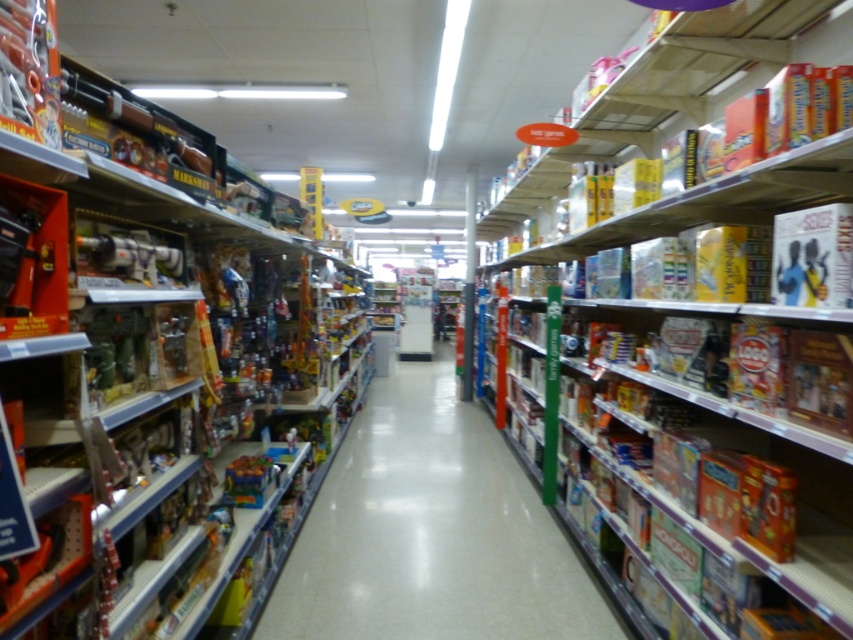
You are a store employee who needs to place a new shelf divider that is 18 inches tall between the cardboard game box at upper right and the matte plastic toys at center. Based on their heights, will the divider be visible above both items when placed between them?

The cardboard game box at upper right is taller than the matte plastic toys at center. Since the divider is 18 inches tall, if the cardboard game box is taller than 18 inches, the divider won t be visible above it. However, if the matte plastic toys are shorter than 18 inches, the divider will be visible above them. Without knowing the exact height of the cardboard game box, we can only confirm that the divider will be visible above the matte plastic toys at center but not necessarily the cardboard game box

You are a store employee who needs to place a new large item on the shelf. The cardboard game box at upper right and the matte plastic toys at center are already on the shelf. Which one can you replace to make space for the new item?

The cardboard game box at upper right is larger in size than the matte plastic toys at center, so replacing the cardboard game box at upper right would free up more space for the new large item.

Consider the image. You are a customer in the store and want to grab both the cardboard game box at upper right and the matte plastic toys at center. Which item should you reach for first if you want to pick up the closer one first?

The cardboard game box at upper right is closer to the viewer than the matte plastic toys at center, so you should reach for the cardboard game box at upper right first.